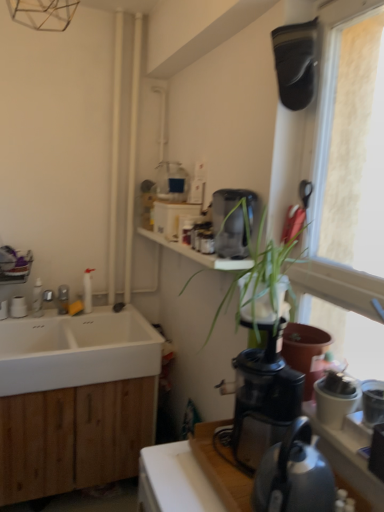
Question: Is there a large distance between white matte sink at lower left and brushed metal faucet at left?

Choices:
 (A) yes
 (B) no

Answer: (B)

Question: Does white matte sink at lower left contain brushed metal faucet at left?

Choices:
 (A) no
 (B) yes

Answer: (A)

Question: Is the depth of white matte sink at lower left greater than that of brushed metal faucet at left?

Choices:
 (A) no
 (B) yes

Answer: (A)

Question: Is white matte sink at lower left directly adjacent to brushed metal faucet at left?

Choices:
 (A) no
 (B) yes

Answer: (A)

Question: From a real-world perspective, does white matte sink at lower left sit lower than brushed metal faucet at left?

Choices:
 (A) no
 (B) yes

Answer: (B)

Question: From a real-world perspective, is white matte sink at lower left physically above brushed metal faucet at left?

Choices:
 (A) yes
 (B) no

Answer: (B)

Question: Is the depth of black plastic coffee maker at center-right, the second coffee maker from the top, less than that of white matte sink at lower left?

Choices:
 (A) yes
 (B) no

Answer: (A)

Question: Does black plastic coffee maker at center-right, which is the 2th coffee maker in back-to-front order, have a larger size compared to white matte sink at lower left?

Choices:
 (A) yes
 (B) no

Answer: (B)

Question: Is black plastic coffee maker at center-right, which is counted as the 1th coffee maker, starting from the bottom, beside white matte sink at lower left?

Choices:
 (A) yes
 (B) no

Answer: (B)

Question: From a real-world perspective, is black plastic coffee maker at center-right, the second coffee maker from the top, below white matte sink at lower left?

Choices:
 (A) no
 (B) yes

Answer: (A)

Question: Can you confirm if black plastic coffee maker at center-right, which is the 2th coffee maker in back-to-front order, is smaller than white matte sink at lower left?

Choices:
 (A) no
 (B) yes

Answer: (B)

Question: Is black plastic coffee maker at center-right, which is counted as the 1th coffee maker, starting from the bottom, at the right side of white matte sink at lower left?

Choices:
 (A) no
 (B) yes

Answer: (B)

Question: Is metallic gray kettle at lower right further to the viewer compared to wooden countertop at lower right?

Choices:
 (A) yes
 (B) no

Answer: (B)